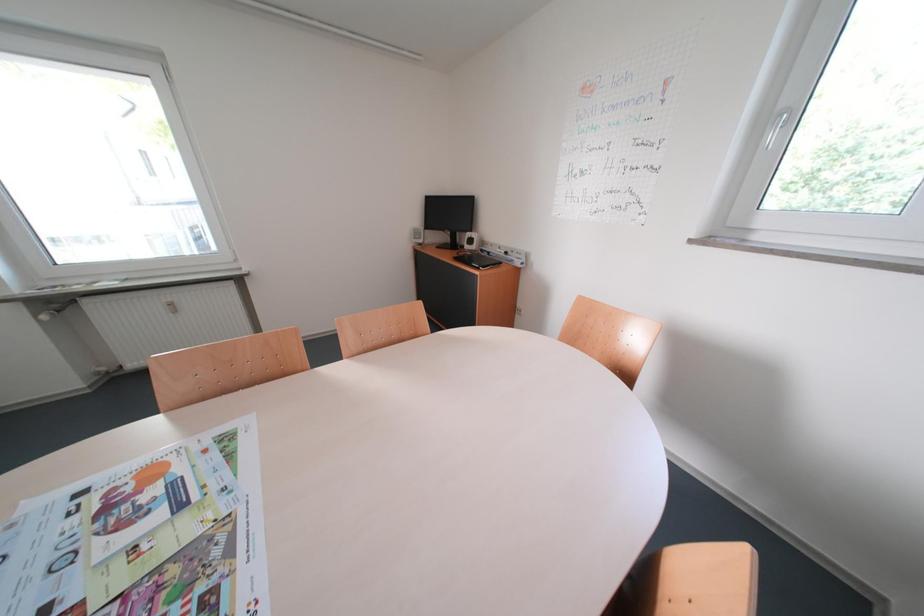
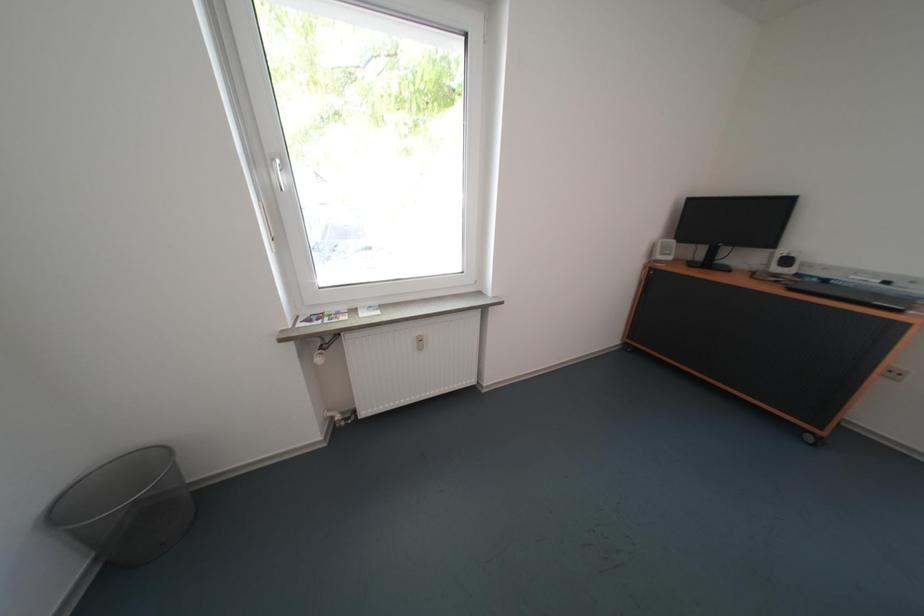
Question: In a continuous first-person perspective shot, in which direction is the camera moving?

Choices:
 (A) Left
 (B) Right
 (C) Forward
 (D) Backward

Answer: (A)